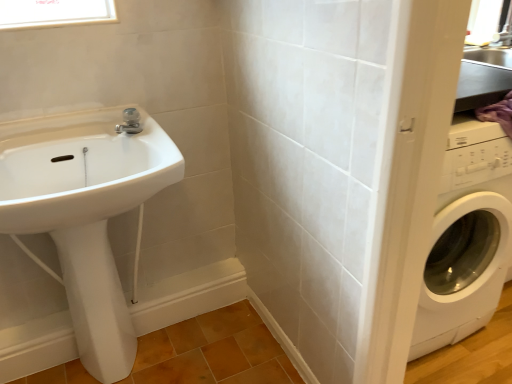
Question: Would you say satin nickel faucet at upper center contains white glossy bidet at lower left?

Choices:
 (A) no
 (B) yes

Answer: (A)

Question: Can you confirm if satin nickel faucet at upper center is wider than white glossy bidet at lower left?

Choices:
 (A) no
 (B) yes

Answer: (A)

Question: Could you tell me if satin nickel faucet at upper center is facing white glossy bidet at lower left?

Choices:
 (A) no
 (B) yes

Answer: (A)

Question: Is satin nickel faucet at upper center not near white glossy bidet at lower left?

Choices:
 (A) yes
 (B) no

Answer: (B)

Question: From the image's perspective, does satin nickel faucet at upper center appear lower than white glossy bidet at lower left?

Choices:
 (A) yes
 (B) no

Answer: (B)

Question: Considering the positions of point (138, 125) and point (1, 3), is point (138, 125) closer or farther from the camera than point (1, 3)?

Choices:
 (A) closer
 (B) farther

Answer: (B)

Question: Looking at their shapes, would you say satin nickel faucet at upper center is wider or thinner than clear glass window at upper left?

Choices:
 (A) wide
 (B) thin

Answer: (A)

Question: Is satin nickel faucet at upper center bigger or smaller than clear glass window at upper left?

Choices:
 (A) small
 (B) big

Answer: (A)

Question: Is satin nickel faucet at upper center inside or outside of clear glass window at upper left?

Choices:
 (A) outside
 (B) inside

Answer: (A)

Question: Is satin nickel faucet at upper center inside the boundaries of white glossy sink at left, or outside?

Choices:
 (A) outside
 (B) inside

Answer: (B)

Question: From a real-world perspective, is satin nickel faucet at upper center physically located above or below white glossy sink at left?

Choices:
 (A) below
 (B) above

Answer: (B)

Question: Based on their sizes in the image, would you say satin nickel faucet at upper center is bigger or smaller than white glossy sink at left?

Choices:
 (A) big
 (B) small

Answer: (B)

Question: Does point (140, 127) appear closer or farther from the camera than point (28, 153)?

Choices:
 (A) farther
 (B) closer

Answer: (A)

Question: Is white glossy bidet at lower left to the left or to the right of clear glass window at upper left in the image?

Choices:
 (A) left
 (B) right

Answer: (B)

Question: From a real-world perspective, relative to clear glass window at upper left, is white glossy bidet at lower left vertically above or below?

Choices:
 (A) above
 (B) below

Answer: (B)